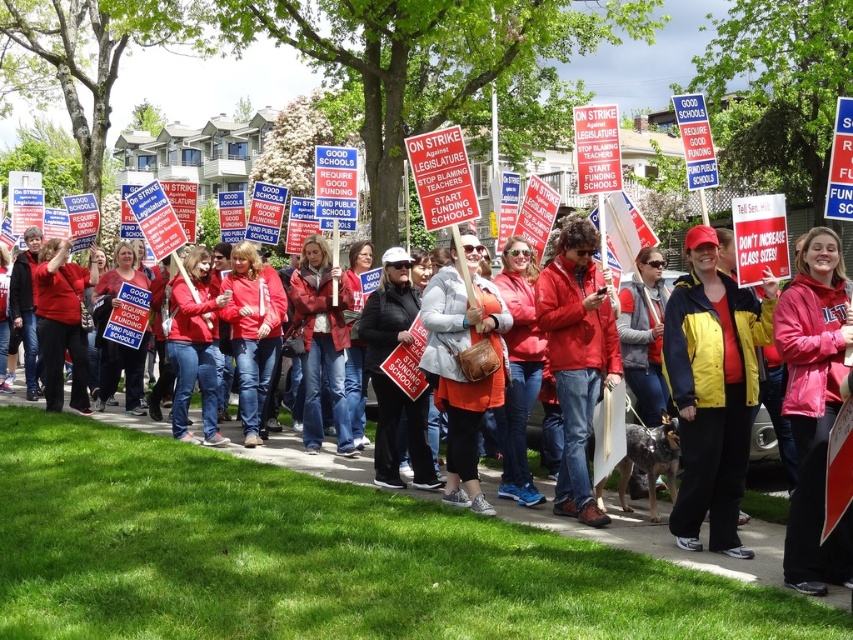
Question: Estimate the real-world distances between objects in this image. Which object is closer to the orange fabric jacket at center?

Choices:
 (A) pink fabric jacket at center
 (B) yellow jacket at center
 (C) matte red jacket at center

Answer: (C)

Question: Among these points, which one is farthest from the camera?

Choices:
 (A) (500, 380)
 (B) (746, 464)
 (C) (796, 348)
 (D) (492, 502)

Answer: (D)

Question: Can you confirm if yellow jacket at center is positioned to the right of pink fabric jacket at center?

Choices:
 (A) no
 (B) yes

Answer: (A)

Question: Is red matte jacket at center smaller than orange fabric jacket at center?

Choices:
 (A) no
 (B) yes

Answer: (B)

Question: Estimate the real-world distances between objects in this image. Which object is closer to the pink fabric jacket at center?

Choices:
 (A) matte red jacket at center
 (B) orange fabric jacket at center
 (C) yellow jacket at center
 (D) red matte jacket at center

Answer: (C)

Question: Does matte red jacket at center lie behind orange fabric jacket at center?

Choices:
 (A) no
 (B) yes

Answer: (A)